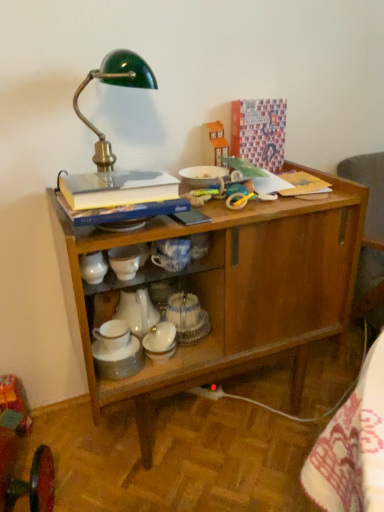
Question: Is green enameled metal desk lamp at upper left facing towards wooden cabinet at center?

Choices:
 (A) no
 (B) yes

Answer: (A)

Question: Does green enameled metal desk lamp at upper left have a lesser width compared to wooden cabinet at center?

Choices:
 (A) yes
 (B) no

Answer: (A)

Question: Is green enameled metal desk lamp at upper left completely or partially outside of wooden cabinet at center?

Choices:
 (A) no
 (B) yes

Answer: (B)

Question: Would you say green enameled metal desk lamp at upper left is a long distance from wooden cabinet at center?

Choices:
 (A) no
 (B) yes

Answer: (A)

Question: Can you confirm if green enameled metal desk lamp at upper left is positioned to the left of wooden cabinet at center?

Choices:
 (A) no
 (B) yes

Answer: (B)

Question: Visually, is white porcelain teapot at center positioned to the left or to the right of hardcover book at upper left?

Choices:
 (A) right
 (B) left

Answer: (B)

Question: Based on their sizes in the image, would you say white porcelain teapot at center is bigger or smaller than hardcover book at upper left?

Choices:
 (A) small
 (B) big

Answer: (A)

Question: From a real-world perspective, is white porcelain teapot at center physically located above or below hardcover book at upper left?

Choices:
 (A) below
 (B) above

Answer: (A)

Question: Considering the positions of white porcelain teapot at center and hardcover book at upper left in the image, is white porcelain teapot at center taller or shorter than hardcover book at upper left?

Choices:
 (A) short
 (B) tall

Answer: (A)

Question: In the image, is green enameled metal desk lamp at upper left positioned in front of or behind white porcelain teapot at center?

Choices:
 (A) behind
 (B) front

Answer: (B)

Question: Based on their positions, is green enameled metal desk lamp at upper left located to the left or right of white porcelain teapot at center?

Choices:
 (A) left
 (B) right

Answer: (A)

Question: From the image's perspective, relative to white porcelain teapot at center, is green enameled metal desk lamp at upper left above or below?

Choices:
 (A) below
 (B) above

Answer: (B)

Question: Is green enameled metal desk lamp at upper left spatially inside white porcelain teapot at center, or outside of it?

Choices:
 (A) outside
 (B) inside

Answer: (A)

Question: Which is correct: wooden cabinet at center is inside green enameled metal desk lamp at upper left, or outside of it?

Choices:
 (A) outside
 (B) inside

Answer: (A)

Question: In terms of height, does wooden cabinet at center look taller or shorter compared to green enameled metal desk lamp at upper left?

Choices:
 (A) tall
 (B) short

Answer: (A)